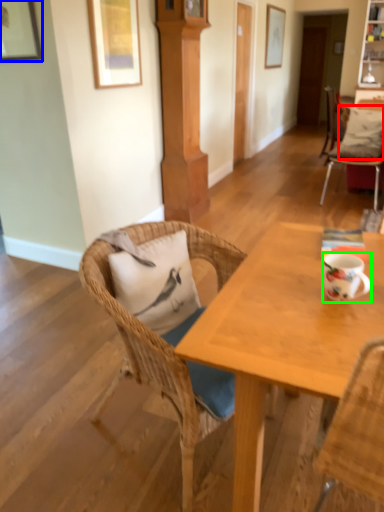
Question: Estimate the real-world distances between objects in this image. Which object is closer to pillow (highlighted by a red box), picture frame (highlighted by a blue box) or coffee cup (highlighted by a green box)?

Choices:
 (A) picture frame
 (B) coffee cup

Answer: (A)